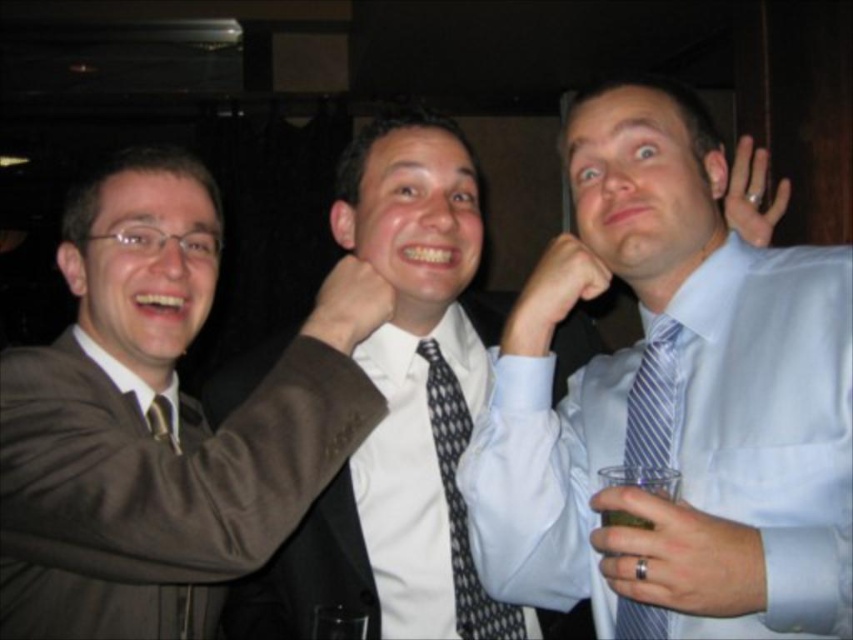
In the image, there are three people. The person on the left is wearing a brown suit jacket, the one in the center has a dark suit jacket, and the third person is on the right. You are standing at point (651, 403). What is the nearest object to you?

The nearest object to you at point (651, 403) is the blue striped tie at right.

In the scene shown: You are a bartender at this bar. You need to place a small drink coaster between the matte black hand at center and the matte silver ring at upper right. The coaster has a diameter of 3 inches. Is there enough space to place it without touching either object?

The distance between the matte black hand at center and the matte silver ring at upper right is 33.11 inches. Since the coaster requires only 3 inches of space, there is ample room to place it between them without touching either object.